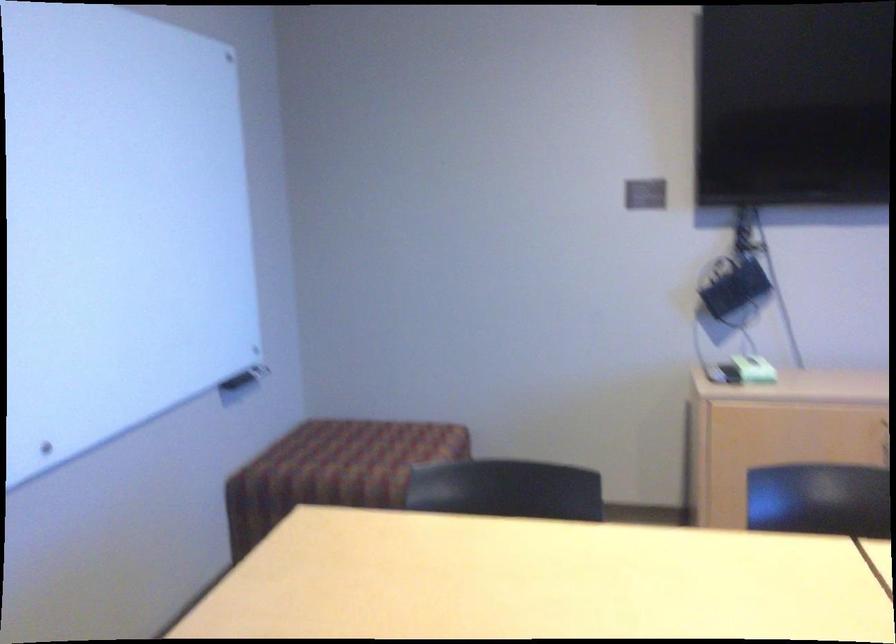
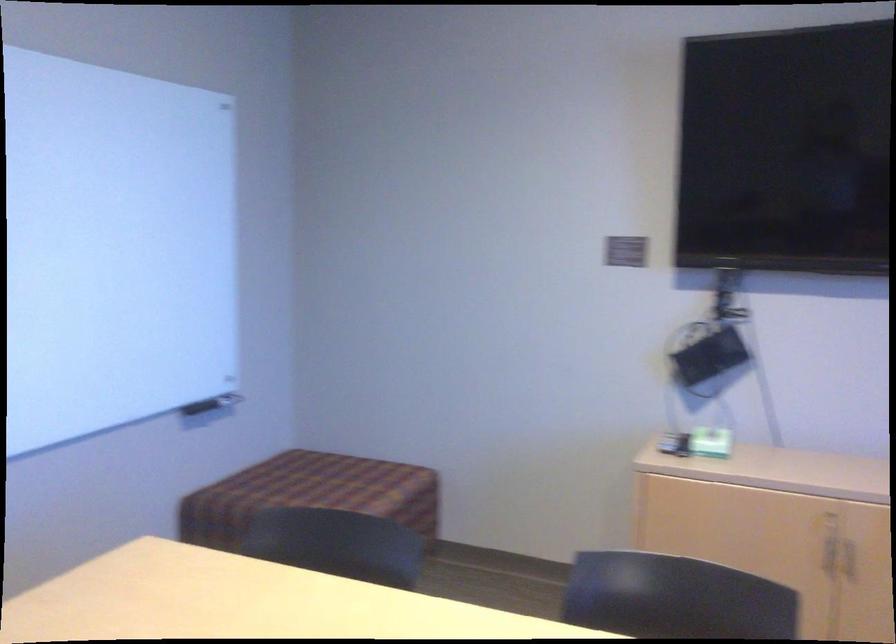
Question: Based on the continuous images, in which direction is the camera rotating? Reply with the corresponding letter.

Choices:
 (A) Left
 (B) Right
 (C) Up
 (D) Down

Answer: (A)